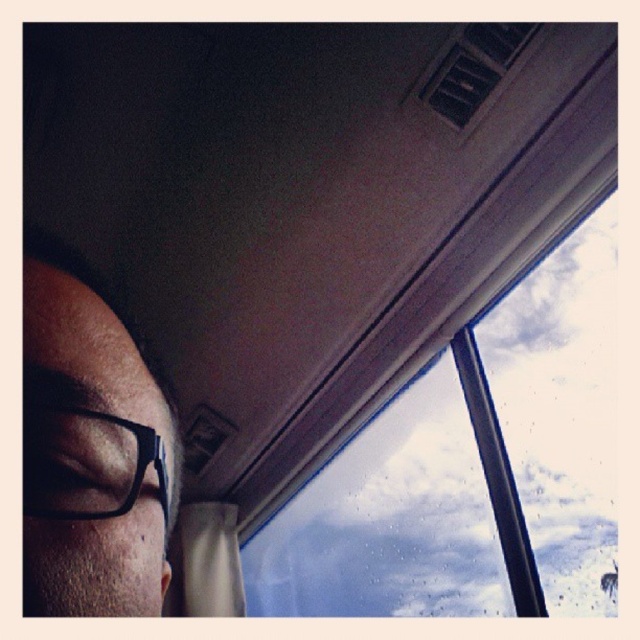
Question: Is matte black glasses at left positioned before black plastic glasses at lower left?

Choices:
 (A) yes
 (B) no

Answer: (A)

Question: Among these objects, which one is nearest to the camera?

Choices:
 (A) matte black glasses at left
 (B) black plastic glasses at lower left

Answer: (A)

Question: Considering the real-world distances, which object is closest to the transparent glass window at upper right?

Choices:
 (A) matte black glasses at left
 (B) black plastic glasses at lower left

Answer: (A)

Question: Does matte black glasses at left have a greater width compared to black plastic glasses at lower left?

Choices:
 (A) no
 (B) yes

Answer: (B)

Question: Which object is positioned closest to the matte black glasses at left?

Choices:
 (A) black plastic glasses at lower left
 (B) transparent glass window at upper right

Answer: (A)

Question: Can you confirm if matte black glasses at left is positioned to the right of black plastic glasses at lower left?

Choices:
 (A) yes
 (B) no

Answer: (B)